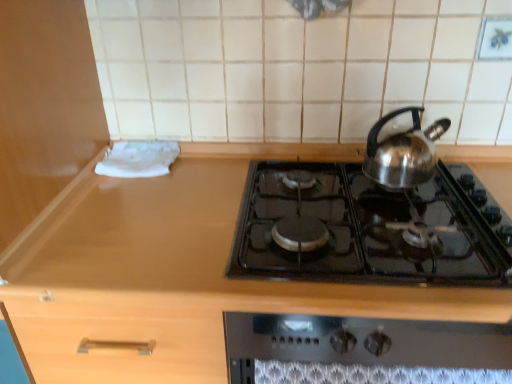
I want to click on black glass gas stove at center, so click(372, 229).

Can you confirm if shiny metallic kettle at upper right is positioned to the left of black glass gas stove at center?

In fact, shiny metallic kettle at upper right is to the right of black glass gas stove at center.

Between shiny metallic kettle at upper right and black glass gas stove at center, which one is positioned behind?

shiny metallic kettle at upper right is behind.

From a real-world perspective, is shiny metallic kettle at upper right on top of black glass gas stove at center?

Yes, from a real-world perspective, shiny metallic kettle at upper right is above black glass gas stove at center.

Based on the photo, can you confirm if black glass gas stove at center is taller than shiny metallic kettle at upper right?

In fact, black glass gas stove at center may be shorter than shiny metallic kettle at upper right.

Is black glass gas stove at center oriented towards shiny metallic kettle at upper right?

No, black glass gas stove at center is not aimed at shiny metallic kettle at upper right.

From the image's perspective, is black glass gas stove at center on top of shiny metallic kettle at upper right?

No, from the image's perspective, black glass gas stove at center is not over shiny metallic kettle at upper right.

Considering the sizes of black glass gas stove at center and shiny metallic kettle at upper right in the image, is black glass gas stove at center wider or thinner than shiny metallic kettle at upper right?

Considering their sizes, black glass gas stove at center looks broader than shiny metallic kettle at upper right.

Considering the relative positions of shiny metallic kettle at upper right and wooden counter at center in the image provided, is shiny metallic kettle at upper right behind wooden counter at center?

Yes, it is.

Are shiny metallic kettle at upper right and wooden counter at center beside each other?

No, shiny metallic kettle at upper right is not in contact with wooden counter at center.

Locate an element on the screen. This screenshot has height=384, width=512. kettle that appears above the wooden counter at center (from the image's perspective) is located at coordinates [403, 152].

From the image's perspective, is shiny metallic kettle at upper right positioned above or below wooden counter at center?

shiny metallic kettle at upper right is situated higher than wooden counter at center in the image.

Does wooden counter at center have a lesser width compared to shiny metallic kettle at upper right?

No.

Which is behind, wooden counter at center or shiny metallic kettle at upper right?

shiny metallic kettle at upper right is further from the camera.

From the image's perspective, is wooden counter at center located above or below shiny metallic kettle at upper right?

wooden counter at center is situated lower than shiny metallic kettle at upper right in the image.

Is shiny metallic kettle at upper right at the back of wooden counter at center?

No, wooden counter at center is not facing the opposite direction of shiny metallic kettle at upper right.

Which object is positioned more to the left, wooden counter at center or black glass gas stove at center?

Positioned to the left is wooden counter at center.

Considering the sizes of objects wooden counter at center and black glass gas stove at center in the image provided, who is wider, wooden counter at center or black glass gas stove at center?

wooden counter at center is wider.

Is wooden counter at center facing away from black glass gas stove at center?

No, black glass gas stove at center is not at the back of wooden counter at center.

From a real-world perspective, is wooden counter at center physically above black glass gas stove at center?

No, from a real-world perspective, wooden counter at center is not on top of black glass gas stove at center.

Is the position of black glass gas stove at center less distant than that of wooden counter at center?

No, black glass gas stove at center is further to the viewer.

Looking at this image, can you confirm if black glass gas stove at center is shorter than wooden counter at center?

Yes, black glass gas stove at center is shorter than wooden counter at center.

Is black glass gas stove at center thinner than wooden counter at center?

Yes, black glass gas stove at center is thinner than wooden counter at center.

Where is `gas stove below the shiny metallic kettle at upper right (from a real-world perspective)`? gas stove below the shiny metallic kettle at upper right (from a real-world perspective) is located at coordinates (372, 229).

At what (x,y) coordinates should I click in order to perform the action: click on kettle behind the black glass gas stove at center. Please return your answer as a coordinate pair (x, y). Looking at the image, I should click on (403, 152).

Looking at the image, which one is located closer to black glass gas stove at center, wooden counter at center or shiny metallic kettle at upper right?

Among the two, shiny metallic kettle at upper right is located nearer to black glass gas stove at center.

Considering their positions, is shiny metallic kettle at upper right positioned closer to black glass gas stove at center than wooden counter at center?

Based on the image, shiny metallic kettle at upper right appears to be nearer to black glass gas stove at center.

In the scene shown: From the image, which object appears to be farther from shiny metallic kettle at upper right, black glass gas stove at center or wooden counter at center?

wooden counter at center.

Estimate the real-world distances between objects in this image. Which object is further from wooden counter at center, black glass gas stove at center or shiny metallic kettle at upper right?

Based on the image, shiny metallic kettle at upper right appears to be further to wooden counter at center.

Estimate the real-world distances between objects in this image. Which object is further from wooden counter at center, shiny metallic kettle at upper right or black glass gas stove at center?

The object further to wooden counter at center is shiny metallic kettle at upper right.

Looking at the image, which one is located closer to shiny metallic kettle at upper right, wooden counter at center or black glass gas stove at center?

Among the two, black glass gas stove at center is located nearer to shiny metallic kettle at upper right.

Find the location of a particular element. This screenshot has width=512, height=384. gas stove between shiny metallic kettle at upper right and wooden counter at center in the up-down direction is located at coordinates (372, 229).